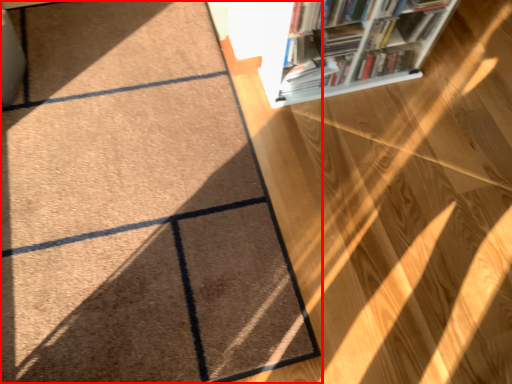
Question: From the image's perspective, where is doormat (annotated by the red box) located in relation to bookcase in the image?

Choices:
 (A) below
 (B) above

Answer: (A)